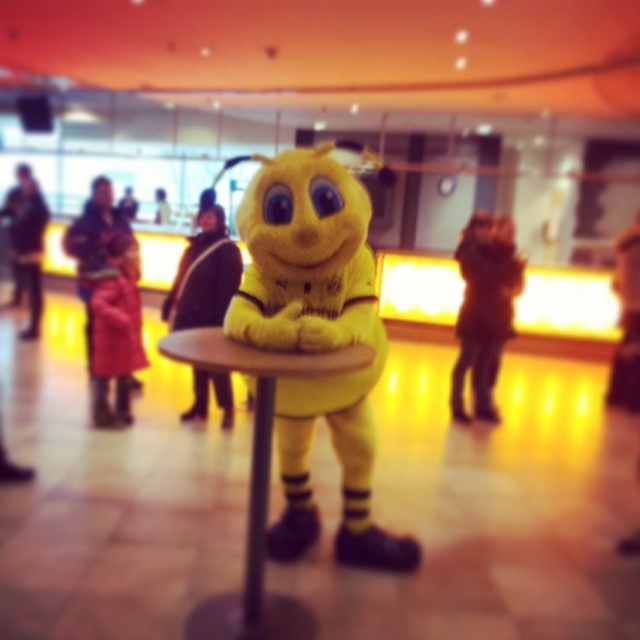
Question: Does dark brown leather coat at center have a greater width compared to black plastic pole at center?

Choices:
 (A) no
 (B) yes

Answer: (B)

Question: Does yellow matte table at center appear over dark brown leather coat at center?

Choices:
 (A) yes
 (B) no

Answer: (B)

Question: Does dark brown leather coat at center appear on the left side of red wool coat at left?

Choices:
 (A) yes
 (B) no

Answer: (B)

Question: Which point is farther to the camera?

Choices:
 (A) (492, 291)
 (B) (253, 538)

Answer: (A)

Question: Among these objects, which one is farthest from the camera?

Choices:
 (A) red wool coat at left
 (B) black plastic pole at center

Answer: (A)

Question: Among these points, which one is nearest to the camera?

Choices:
 (A) (470, 275)
 (B) (177, 355)

Answer: (B)